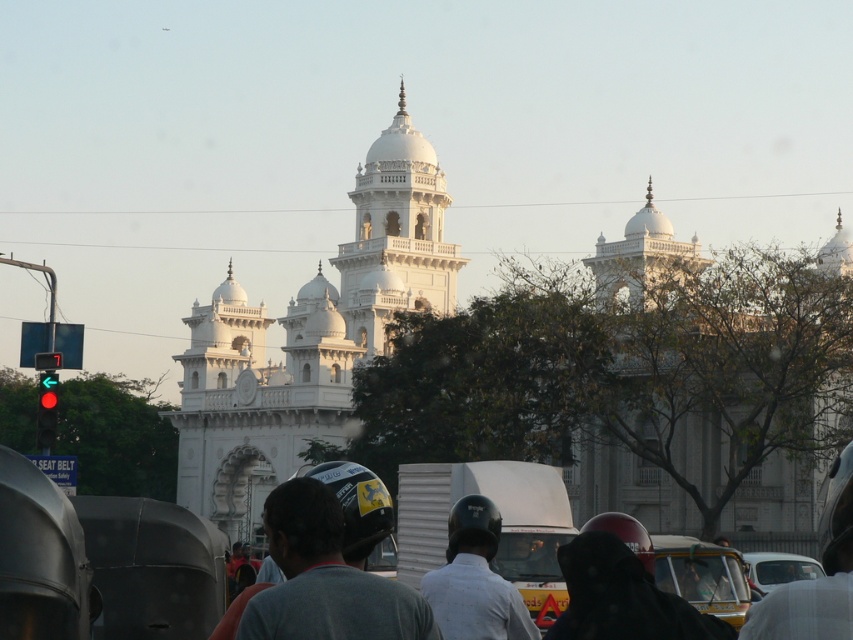
Question: Does white helmet at center appear over white glossy car at center?

Choices:
 (A) no
 (B) yes

Answer: (B)

Question: Which of these objects is positioned farthest from the red glass traffic light at left?

Choices:
 (A) white helmet at center
 (B) white glossy car at center
 (C) white marble palace at center

Answer: (A)

Question: Does white helmet at center appear over white glossy car at center?

Choices:
 (A) no
 (B) yes

Answer: (B)

Question: Does yellow matte taxi at lower right appear on the left side of red glass traffic light at left?

Choices:
 (A) no
 (B) yes

Answer: (A)

Question: Which object is positioned farthest from the white marble palace at center?

Choices:
 (A) yellow matte taxi at lower right
 (B) white glossy car at center
 (C) white helmet at center
 (D) red glass traffic light at left

Answer: (B)

Question: Which of the following is the closest to the observer?

Choices:
 (A) (x=474, y=340)
 (B) (x=747, y=557)

Answer: (B)